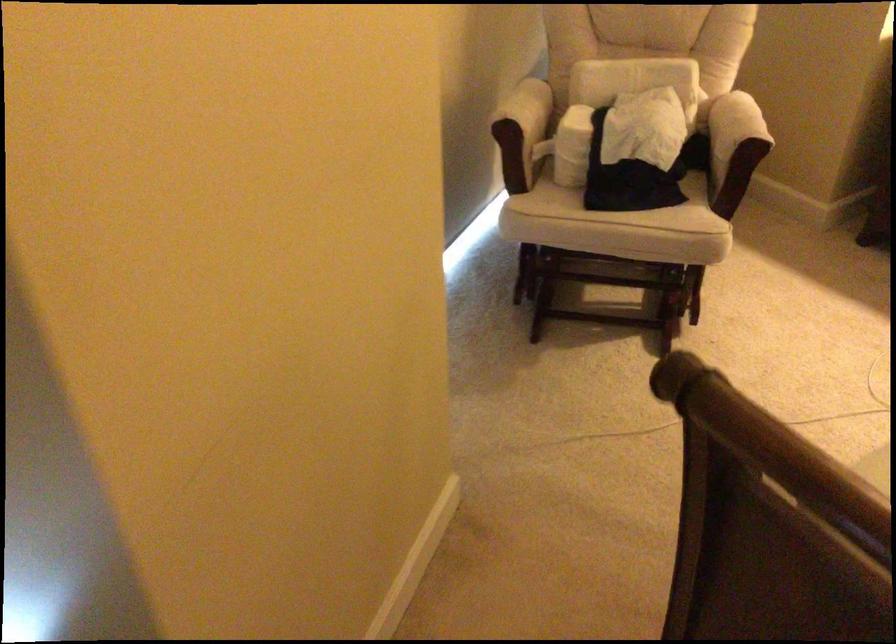
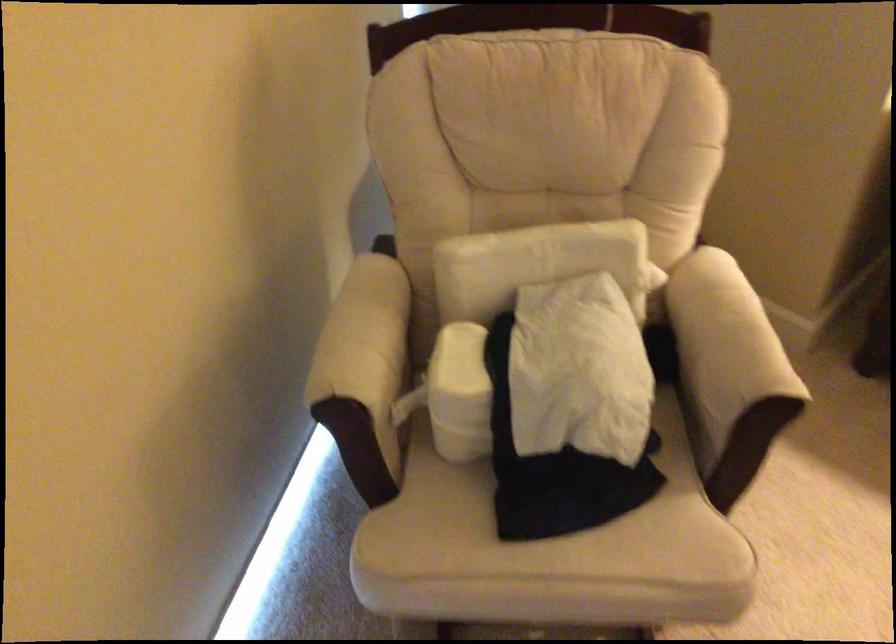
In the second image, find the point that corresponds to (x=615, y=211) in the first image.

(545, 535)